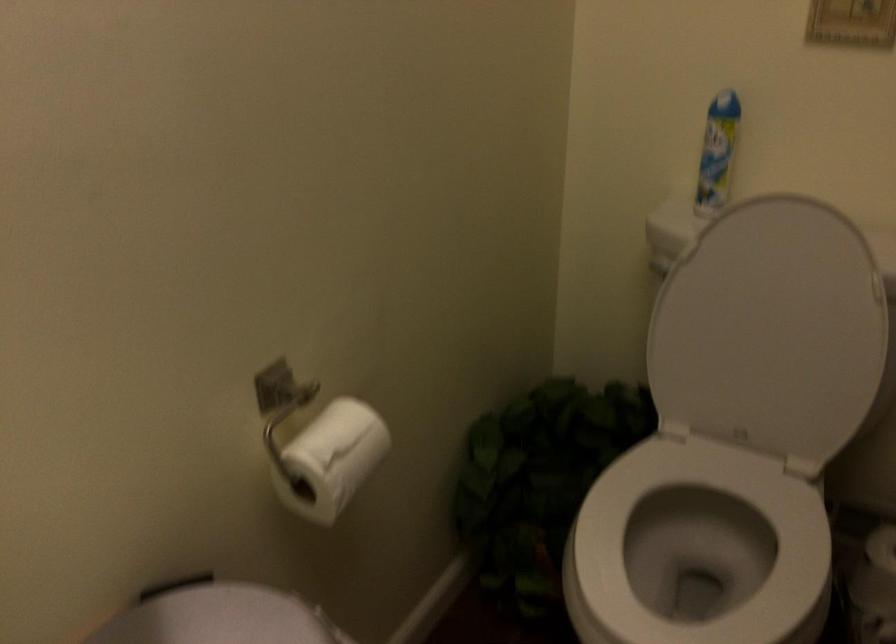
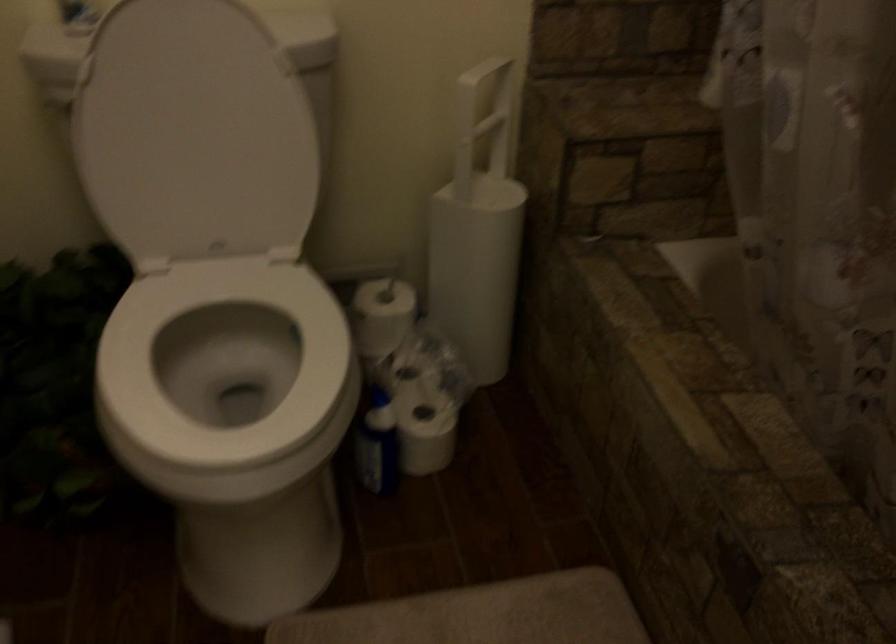
Where in the second image is the point corresponding to the point at 691,542 from the first image?

(224, 365)